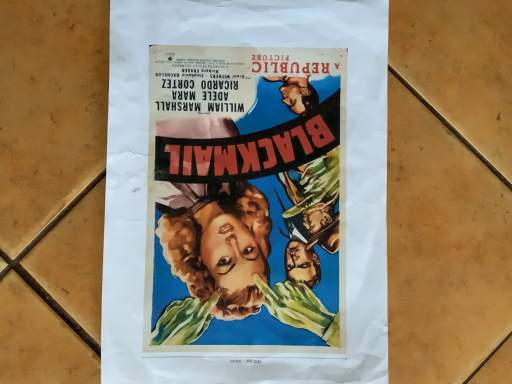
Identify the location of matte paper poster at center. (245, 192).

Based on the photo, in order to face matte paper poster at center, should I rotate leftwards or rightwards?

It's best to rotate left around 0.515 degrees.

What do you see at coordinates (245, 192) in the screenshot?
I see `matte paper poster at center` at bounding box center [245, 192].

Locate an element on the screen. The height and width of the screenshot is (384, 512). matte paper poster at center is located at coordinates (245, 192).